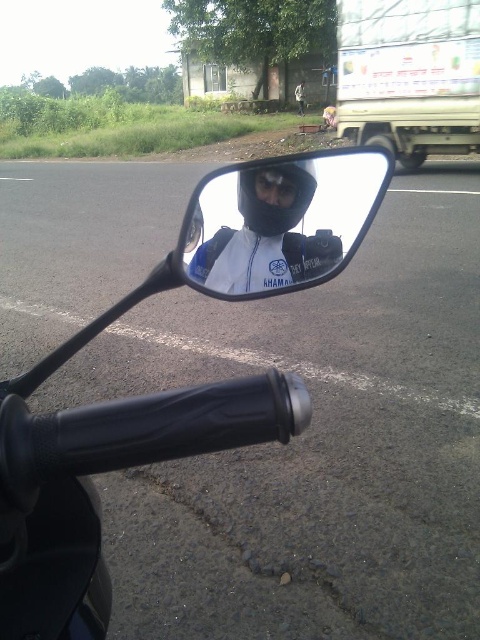
Question: Does black matte motorcycle handlebar at center lie in front of matte black mirror at center?

Choices:
 (A) yes
 (B) no

Answer: (A)

Question: Can you confirm if black matte motorcycle handlebar at center is smaller than matte black mirror at center?

Choices:
 (A) no
 (B) yes

Answer: (A)

Question: Is black matte motorcycle handlebar at center below matte black mirror at center?

Choices:
 (A) yes
 (B) no

Answer: (A)

Question: Among these objects, which one is farthest from the camera?

Choices:
 (A) matte black mirror at center
 (B) black matte motorcycle handlebar at center

Answer: (A)